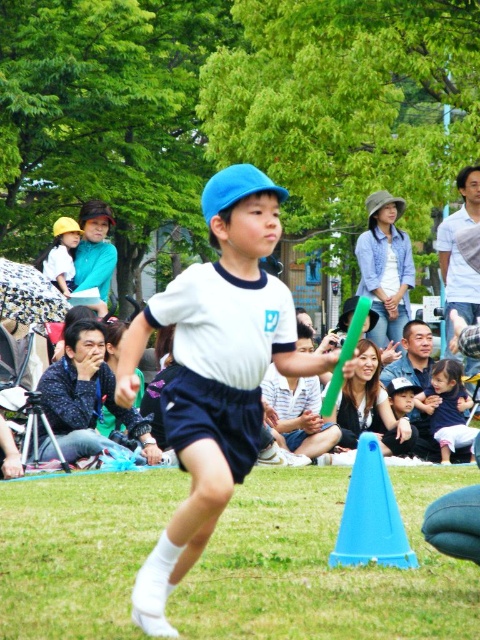
Question: Estimate the real-world distances between objects in this image. Which object is closer to the matte blue cap at center?

Choices:
 (A) green grass at lower center
 (B) blue plastic cone at lower center
 (C) white matte uniform at center
 (D) dark blue jersey at center

Answer: (D)

Question: Is green grass at lower center wider than white matte uniform at center?

Choices:
 (A) no
 (B) yes

Answer: (A)

Question: Which of the following is the farthest from the observer?

Choices:
 (A) (54, 248)
 (B) (450, 404)

Answer: (A)

Question: Does matte black shirt at lower left appear on the right side of blue plastic cone at lower center?

Choices:
 (A) no
 (B) yes

Answer: (A)

Question: Among these objects, which one is nearest to the camera?

Choices:
 (A) dark blue jersey at center
 (B) green grass at lower center
 (C) matte black shirt at lower left

Answer: (B)

Question: Is white matte uniform at center closer to camera compared to matte blue cap at center?

Choices:
 (A) no
 (B) yes

Answer: (B)